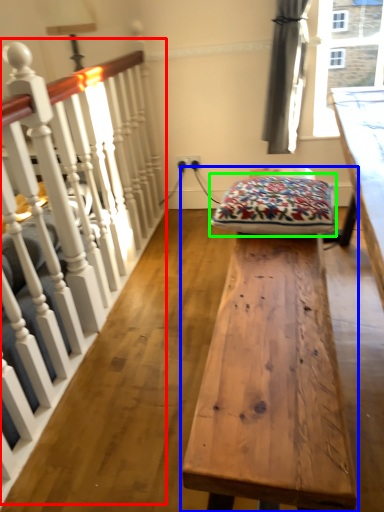
Question: Which object is positioned closest to rail (highlighted by a red box)? Select from table (highlighted by a blue box) and blanket (highlighted by a green box).

Choices:
 (A) table
 (B) blanket

Answer: (B)